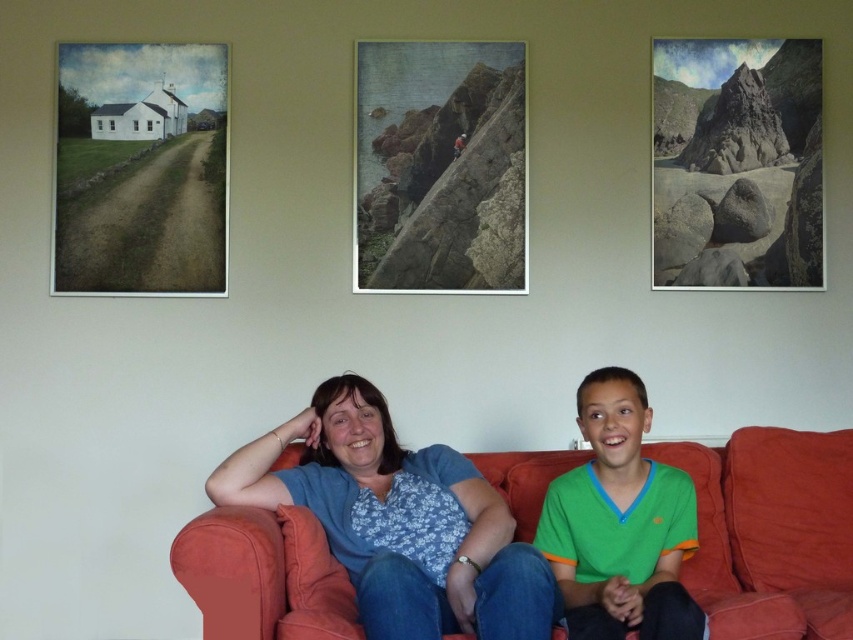
Is blue floral shirt at center taller than rugged stone boulders at upper right?

No, blue floral shirt at center is not taller than rugged stone boulders at upper right.

Which is more to the left, blue floral shirt at center or rugged stone boulders at upper right?

From the viewer's perspective, blue floral shirt at center appears more on the left side.

This screenshot has height=640, width=853. Find the location of `blue floral shirt at center`. blue floral shirt at center is located at coordinates (398, 522).

Can you confirm if matte paper landscape at left is positioned below smooth stone cliff at center?

Yes, matte paper landscape at left is below smooth stone cliff at center.

Is matte paper landscape at left shorter than smooth stone cliff at center?

Yes, matte paper landscape at left is shorter than smooth stone cliff at center.

Is point (125, 152) positioned behind point (520, 172)?

No.

I want to click on matte paper landscape at left, so click(x=141, y=170).

Does point (219, 532) come closer to viewer compared to point (421, 116)?

Yes.

Who is taller, velvet orange couch at center or smooth stone cliff at center?

smooth stone cliff at center is taller.

Which is behind, point (810, 476) or point (460, 188)?

Positioned behind is point (460, 188).

Identify the location of velvet orange couch at center. This screenshot has width=853, height=640. (770, 531).